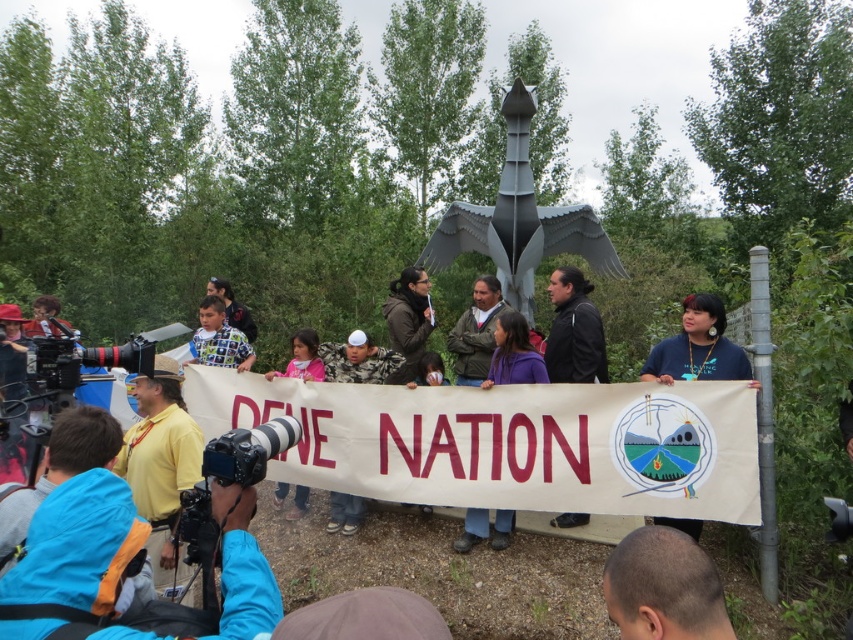
Image resolution: width=853 pixels, height=640 pixels. Describe the element at coordinates (663, 588) in the screenshot. I see `bald head at lower right` at that location.

From the picture: Can you confirm if bald head at lower right is positioned below black plastic video camera at lower left?

Indeed, bald head at lower right is positioned under black plastic video camera at lower left.

Locate an element on the screen. bald head at lower right is located at coordinates (x=663, y=588).

Who is higher up, yellow shirt at center or black leather jacket at center?

black leather jacket at center is above.

Does yellow shirt at center have a lesser height compared to black leather jacket at center?

No.

Describe the element at coordinates (160, 458) in the screenshot. I see `yellow shirt at center` at that location.

Locate an element on the screen. This screenshot has width=853, height=640. yellow shirt at center is located at coordinates (160, 458).

Is point (233, 348) in front of point (282, 490)?

Yes, it is.

Does printed fabric shirt at center have a lesser width compared to pink fabric shirt at center?

Incorrect, printed fabric shirt at center's width is not less than pink fabric shirt at center's.

Describe the element at coordinates (218, 339) in the screenshot. I see `printed fabric shirt at center` at that location.

Locate an element on the screen. The height and width of the screenshot is (640, 853). printed fabric shirt at center is located at coordinates (218, 339).